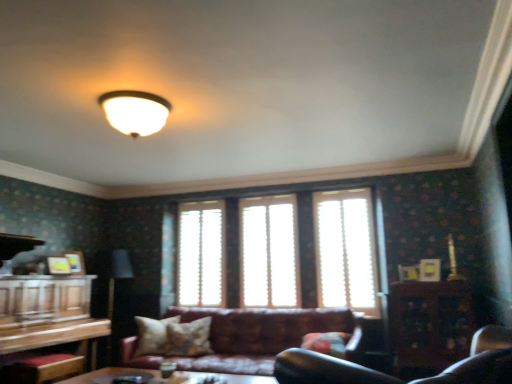
Question: Are translucent wood blinds at center, the 2th window in the left-to-right sequence, and matte white ceiling light at upper center located far from each other?

Choices:
 (A) yes
 (B) no

Answer: (A)

Question: Can you see translucent wood blinds at center, the 2th window in the left-to-right sequence, touching matte white ceiling light at upper center?

Choices:
 (A) yes
 (B) no

Answer: (B)

Question: From a real-world perspective, is translucent wood blinds at center, the 2th window in the left-to-right sequence, beneath matte white ceiling light at upper center?

Choices:
 (A) no
 (B) yes

Answer: (B)

Question: Does translucent wood blinds at center, the 2th window in the left-to-right sequence, have a greater width compared to matte white ceiling light at upper center?

Choices:
 (A) no
 (B) yes

Answer: (A)

Question: Considering the relative sizes of translucent wood blinds at center, placed as the second window when sorted from right to left, and matte white ceiling light at upper center in the image provided, is translucent wood blinds at center, placed as the second window when sorted from right to left, bigger than matte white ceiling light at upper center?

Choices:
 (A) no
 (B) yes

Answer: (B)

Question: Based on their sizes in the image, would you say wooden cabinet at right is bigger or smaller than leather couch at center?

Choices:
 (A) big
 (B) small

Answer: (B)

Question: Relative to leather couch at center, is wooden cabinet at right in front or behind?

Choices:
 (A) behind
 (B) front

Answer: (A)

Question: Looking at their shapes, would you say wooden cabinet at right is wider or thinner than leather couch at center?

Choices:
 (A) thin
 (B) wide

Answer: (A)

Question: Considering the positions of wooden cabinet at right and leather couch at center in the image, is wooden cabinet at right taller or shorter than leather couch at center?

Choices:
 (A) tall
 (B) short

Answer: (A)

Question: Considering the positions of white wood blinds at center, which ranks as the 1th window in right-to-left order, and translucent wood blinds at center, placed as the second window when sorted from right to left, in the image, is white wood blinds at center, which ranks as the 1th window in right-to-left order, wider or thinner than translucent wood blinds at center, placed as the second window when sorted from right to left,?

Choices:
 (A) thin
 (B) wide

Answer: (A)

Question: Is white wood blinds at center, which ranks as the 1th window in right-to-left order, bigger or smaller than translucent wood blinds at center, placed as the second window when sorted from right to left?

Choices:
 (A) big
 (B) small

Answer: (B)

Question: Is white wood blinds at center, the 3th window positioned from the left, inside the boundaries of translucent wood blinds at center, placed as the second window when sorted from right to left, or outside?

Choices:
 (A) outside
 (B) inside

Answer: (A)

Question: Does point (343, 196) appear closer or farther from the camera than point (282, 206)?

Choices:
 (A) farther
 (B) closer

Answer: (B)

Question: Looking at their shapes, would you say patterned fabric pillow at center, positioned as the second pillow in left-to-right order, is wider or thinner than fluffy fabric pillow at lower center, the 3th pillow viewed from the left?

Choices:
 (A) wide
 (B) thin

Answer: (B)

Question: From the image's perspective, is patterned fabric pillow at center, positioned as the second pillow in left-to-right order, positioned above or below fluffy fabric pillow at lower center, the 3th pillow viewed from the left?

Choices:
 (A) below
 (B) above

Answer: (A)